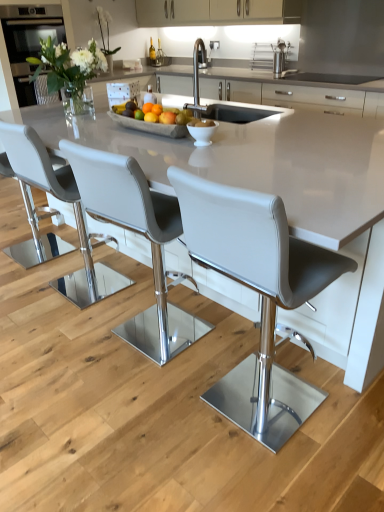
I want to click on free spot to the left of matte gray chair at center, which is the fourth chair in left-to-right order, so click(x=156, y=419).